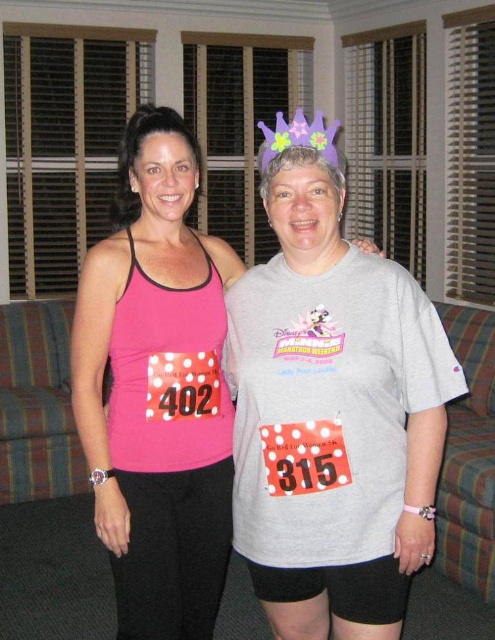
Is matte gray t-shirt at center positioned before pink matte tank top at center?

Yes, it is.

Between matte gray t-shirt at center and pink matte tank top at center, which one is positioned lower?

matte gray t-shirt at center is lower down.

Identify the location of matte gray t-shirt at center. (332, 408).